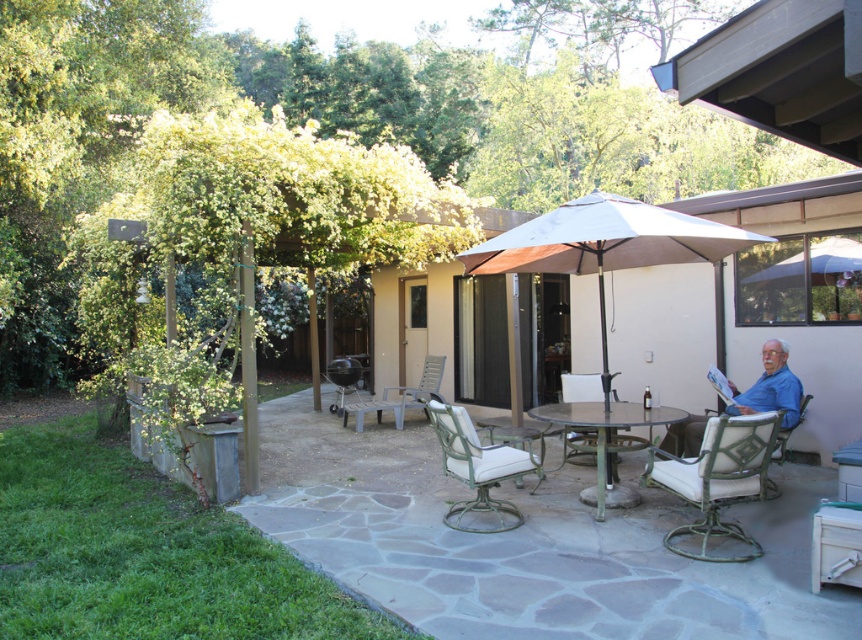
Question: Among these objects, which one is farthest from the camera?

Choices:
 (A) white fabric umbrella at center
 (B) green metal chair at center
 (C) white fabric umbrella at upper right

Answer: (C)

Question: Can you confirm if white fabric umbrella at upper right is positioned to the right of metallic green chair at lower right?

Choices:
 (A) no
 (B) yes

Answer: (B)

Question: Which point appears closest to the camera in this image?

Choices:
 (A) (475, 253)
 (B) (466, 444)
 (C) (564, 372)

Answer: (B)

Question: From the image, what is the correct spatial relationship of green metal chair at lower right in relation to black matte grill at center?

Choices:
 (A) left
 (B) right

Answer: (B)

Question: Does green metal chair at center have a lesser width compared to metallic green chair at lower right?

Choices:
 (A) yes
 (B) no

Answer: (A)

Question: Which of the following is the farthest from the observer?

Choices:
 (A) green metal chair at lower right
 (B) blue fabric chair at right
 (C) black matte grill at center
 (D) metallic green chair at lower right

Answer: (C)